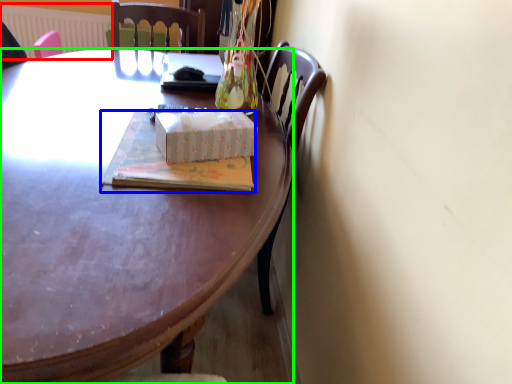
Question: Estimate the real-world distances between objects in this image. Which object is farther from radiator (highlighted by a red box), book (highlighted by a blue box) or desk (highlighted by a green box)?

Choices:
 (A) book
 (B) desk

Answer: (A)